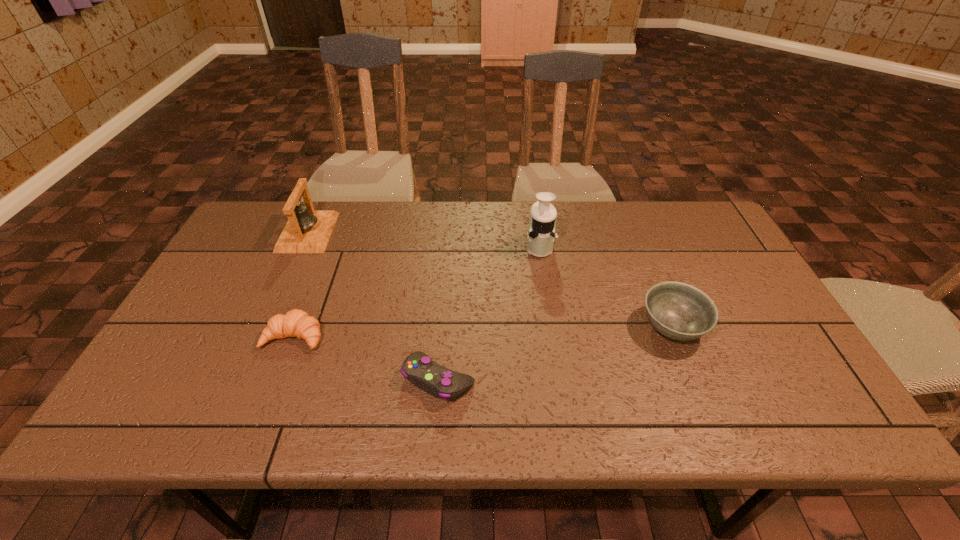
This screenshot has width=960, height=540. In the image, there is a desktop. In order to click on vacant space at the near left corner in this screenshot , I will do `click(160, 431)`.

This screenshot has width=960, height=540. In the image, there is a desktop. What are the coordinates of `vacant region at the far right corner` in the screenshot? It's located at (681, 240).

Identify the location of free space between the rightmost object and the fourth object from left to right. (606, 287).

Locate an element on the screen. The width and height of the screenshot is (960, 540). free space between the third object from right to left and the juicer is located at coordinates (489, 313).

Locate an element on the screen. This screenshot has width=960, height=540. free space between the crescent roll and the bowl is located at coordinates (483, 332).

Find the location of a particular element. vacant area between the second object from right to left and the fourth shortest object is located at coordinates (423, 239).

In order to click on free space between the control and the bell in this screenshot , I will do `click(373, 306)`.

This screenshot has height=540, width=960. In order to click on vacant area that lies between the bell and the third object from right to left in this screenshot , I will do `click(373, 306)`.

The image size is (960, 540). I want to click on vacant area that lies between the bell and the bowl, so point(490,280).

In order to click on vacant area that lies between the bell and the third object from left to right in this screenshot , I will do `click(373, 306)`.